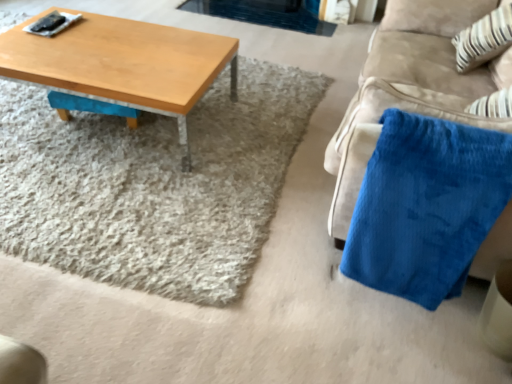
Question: From the image's perspective, would you say light brown wood coffee table at upper left is positioned over velvety blue blanket at right?

Choices:
 (A) no
 (B) yes

Answer: (B)

Question: Does light brown wood coffee table at upper left have a lesser width compared to velvety blue blanket at right?

Choices:
 (A) no
 (B) yes

Answer: (B)

Question: Is velvety blue blanket at right a part of light brown wood coffee table at upper left?

Choices:
 (A) no
 (B) yes

Answer: (A)

Question: Is light brown wood coffee table at upper left further to camera compared to velvety blue blanket at right?

Choices:
 (A) no
 (B) yes

Answer: (B)

Question: Is the surface of light brown wood coffee table at upper left in direct contact with velvety blue blanket at right?

Choices:
 (A) yes
 (B) no

Answer: (B)

Question: In terms of size, does light brown wood coffee table at upper left appear bigger or smaller than white striped fabric at upper right?

Choices:
 (A) small
 (B) big

Answer: (B)

Question: Considering the positions of point coord(212,79) and point coord(503,9), is point coord(212,79) closer or farther from the camera than point coord(503,9)?

Choices:
 (A) farther
 (B) closer

Answer: (B)

Question: Looking at their shapes, would you say light brown wood coffee table at upper left is wider or thinner than white striped fabric at upper right?

Choices:
 (A) thin
 (B) wide

Answer: (B)

Question: Would you say light brown wood coffee table at upper left is inside or outside white striped fabric at upper right?

Choices:
 (A) outside
 (B) inside

Answer: (A)

Question: From a real-world perspective, relative to velvety blue blanket at right, is white striped fabric at upper right vertically above or below?

Choices:
 (A) below
 (B) above

Answer: (B)

Question: Looking at the image, does white striped fabric at upper right seem bigger or smaller compared to velvety blue blanket at right?

Choices:
 (A) small
 (B) big

Answer: (A)

Question: Visually, is white striped fabric at upper right positioned to the left or to the right of velvety blue blanket at right?

Choices:
 (A) right
 (B) left

Answer: (A)

Question: From the image's perspective, is white striped fabric at upper right above or below velvety blue blanket at right?

Choices:
 (A) below
 (B) above

Answer: (B)

Question: Considering their positions, is light brown wood coffee table at upper left located in front of or behind velvety blue blanket at right?

Choices:
 (A) behind
 (B) front

Answer: (A)

Question: Based on their sizes in the image, would you say light brown wood coffee table at upper left is bigger or smaller than velvety blue blanket at right?

Choices:
 (A) small
 (B) big

Answer: (A)